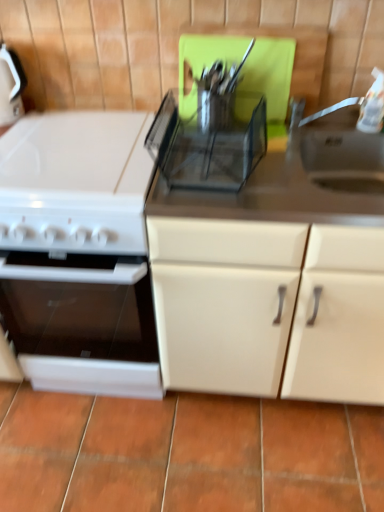
Question: Does transparent plastic utensil rack at center appear on the right side of white glossy oven at left?

Choices:
 (A) no
 (B) yes

Answer: (B)

Question: From a real-world perspective, is transparent plastic utensil rack at center physically above white glossy oven at left?

Choices:
 (A) yes
 (B) no

Answer: (A)

Question: Is transparent plastic utensil rack at center closer to camera compared to white glossy oven at left?

Choices:
 (A) no
 (B) yes

Answer: (B)

Question: Would you say transparent plastic utensil rack at center is outside white glossy oven at left?

Choices:
 (A) no
 (B) yes

Answer: (B)

Question: Can you confirm if transparent plastic utensil rack at center is bigger than white glossy oven at left?

Choices:
 (A) no
 (B) yes

Answer: (A)

Question: Considering the relative sizes of transparent plastic utensil rack at center and white glossy oven at left in the image provided, is transparent plastic utensil rack at center wider than white glossy oven at left?

Choices:
 (A) yes
 (B) no

Answer: (B)

Question: Does matte white cabinet at center have a lesser height compared to white glossy oven at left?

Choices:
 (A) no
 (B) yes

Answer: (A)

Question: Can you confirm if matte white cabinet at center is wider than white glossy oven at left?

Choices:
 (A) yes
 (B) no

Answer: (B)

Question: From a real-world perspective, is matte white cabinet at center below white glossy oven at left?

Choices:
 (A) yes
 (B) no

Answer: (B)

Question: Is white glossy oven at left located within matte white cabinet at center?

Choices:
 (A) no
 (B) yes

Answer: (A)

Question: From the image's perspective, does matte white cabinet at center appear lower than white glossy oven at left?

Choices:
 (A) no
 (B) yes

Answer: (A)

Question: From a real-world perspective, is matte white cabinet at center on white glossy oven at left?

Choices:
 (A) no
 (B) yes

Answer: (B)

Question: Does terracotta tile at lower center have a lesser width compared to matte white cabinet at center?

Choices:
 (A) yes
 (B) no

Answer: (B)